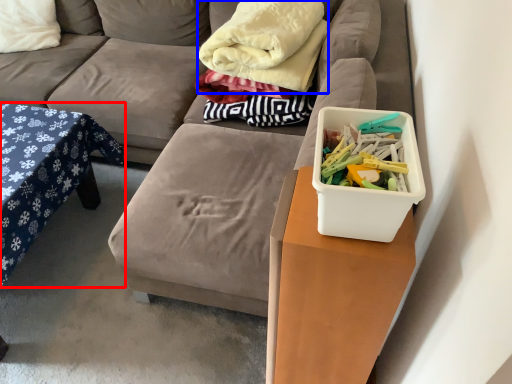
Question: Which of the following is the closest to the observer, table (highlighted by a red box) or blanket (highlighted by a blue box)?

Choices:
 (A) table
 (B) blanket

Answer: (A)